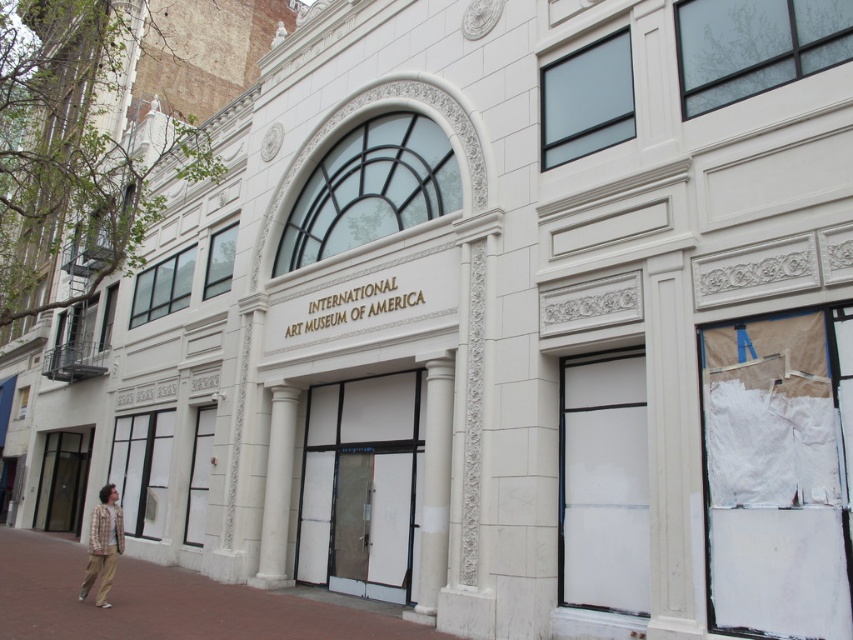
Looking at this image, you are standing in front of the International Art Museum of America and want to take a photo of the entrance. To get a clear shot of the white marble pillar at center, should you stand on the brown brick pavement at lower left or move to a different spot?

The brown brick pavement at lower left is below the white marble pillar at center, so standing on it would position you directly under the pillar. To capture the pillar in your photo, you should move to a different spot where you can see it fully without obstruction.

You are an art student standing in front of the International Art Museum of America. You notice a plaid shirt at lower left and a white marble column at center. Which object is closer to you?

The plaid shirt at lower left is behind the white marble column at center, so the white marble column at center is closer to you.